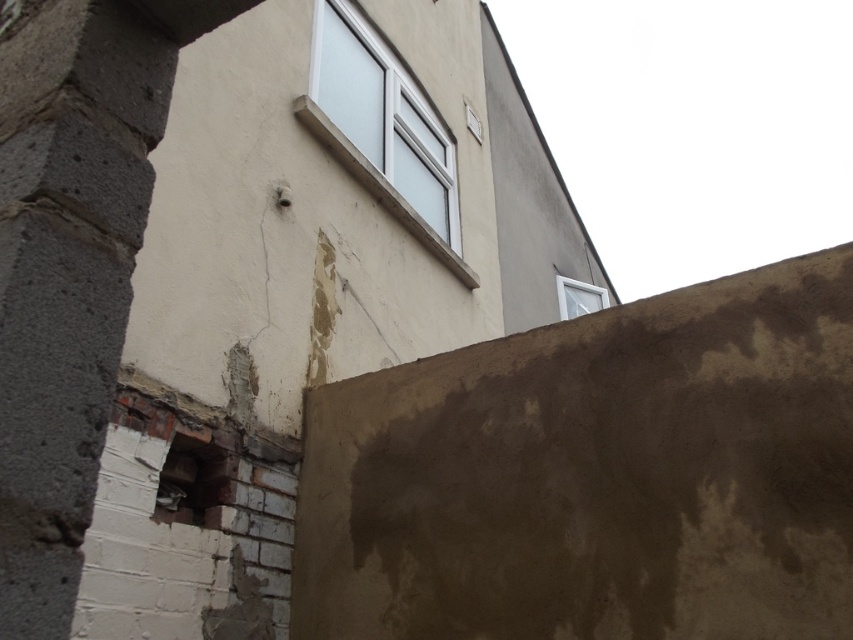
Question: Can you confirm if white frosted glass window at upper center is thinner than white plastic window at upper right?

Choices:
 (A) yes
 (B) no

Answer: (B)

Question: Does white frosted glass window at upper center appear on the left side of white plastic window at upper right?

Choices:
 (A) yes
 (B) no

Answer: (A)

Question: Can you confirm if white frosted glass window at upper center is bigger than white plastic window at upper right?

Choices:
 (A) no
 (B) yes

Answer: (B)

Question: Among these points, which one is nearest to the camera?

Choices:
 (A) (589, 307)
 (B) (364, 35)

Answer: (B)

Question: Which point is farther to the camera?

Choices:
 (A) (355, 33)
 (B) (589, 284)

Answer: (B)